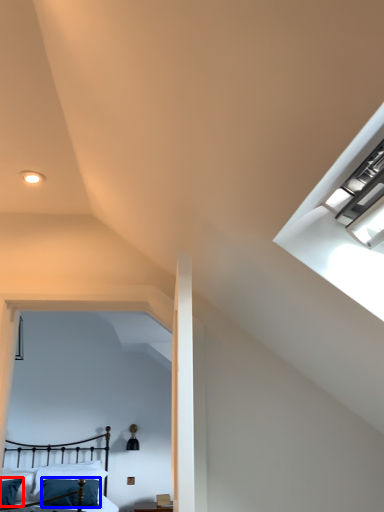
Question: Which point is closer to the camera, pillow (highlighted by a red box) or pillow (highlighted by a blue box)?

Choices:
 (A) pillow
 (B) pillow

Answer: (A)